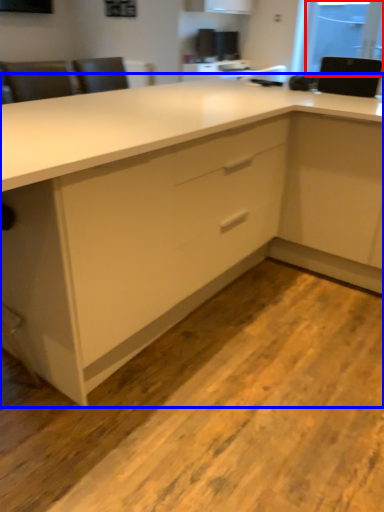
Question: Which of the following is the farthest to the observer, window screen (highlighted by a red box) or cabinetry (highlighted by a blue box)?

Choices:
 (A) window screen
 (B) cabinetry

Answer: (A)